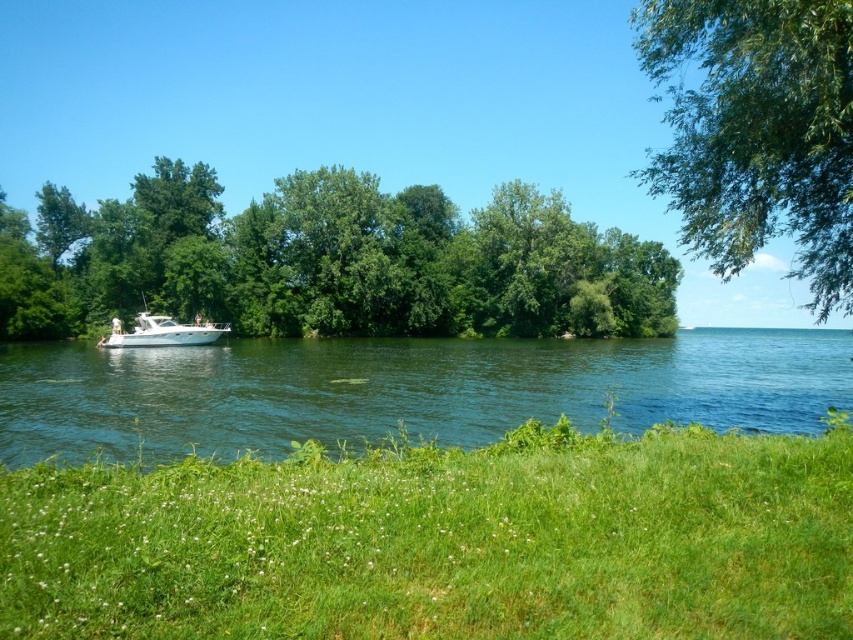
Can you confirm if green leafy trees at left is positioned to the left of green water at lower center?

Indeed, green leafy trees at left is positioned on the left side of green water at lower center.

Find the location of `green leafy trees at left`. green leafy trees at left is located at coordinates (328, 260).

Image resolution: width=853 pixels, height=640 pixels. What are the coordinates of `green leafy trees at left` in the screenshot? It's located at (328, 260).

Is green leafy trees at left further to camera compared to green leafy tree at upper right?

Yes, green leafy trees at left is further from the viewer.

Who is lower down, green leafy trees at left or green leafy tree at upper right?

green leafy trees at left is below.

What do you see at coordinates (328, 260) in the screenshot?
I see `green leafy trees at left` at bounding box center [328, 260].

Find the location of a particular element. This screenshot has height=640, width=853. green leafy trees at left is located at coordinates (328, 260).

Does point (254, 419) come farther from viewer compared to point (216, 326)?

No.

Can you confirm if green water at lower center is bigger than white glossy boat at left?

Correct, green water at lower center is larger in size than white glossy boat at left.

Does point (370, 380) come closer to viewer compared to point (161, 317)?

Yes, point (370, 380) is closer to viewer.

Where is `green water at lower center`? The width and height of the screenshot is (853, 640). green water at lower center is located at coordinates (405, 390).